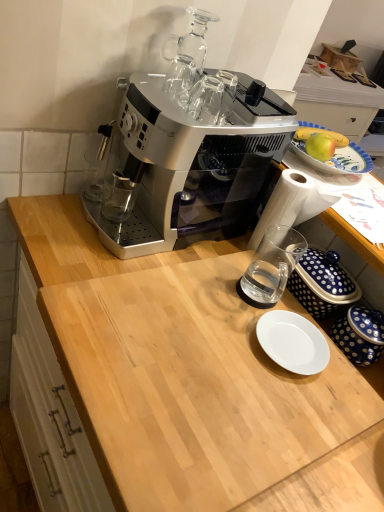
Question: In terms of width, does white glossy plate at center look wider or thinner when compared to clear glass cup at center?

Choices:
 (A) thin
 (B) wide

Answer: (B)

Question: From the image's perspective, is white glossy plate at center located above or below clear glass cup at center?

Choices:
 (A) above
 (B) below

Answer: (B)

Question: Which object is positioned closest to the transparent glass cups at upper center?

Choices:
 (A) satin silver coffee maker at upper center
 (B) blue dotted ceramic jar at lower right
 (C) clear glass cup at center
 (D) green matte apple at upper right
 (E) light wood cutting board at center

Answer: (A)

Question: Which is farther from the light wood cutting board at center?

Choices:
 (A) clear glass cup at center
 (B) green matte apple at upper right
 (C) white glossy plate at center
 (D) transparent glass cups at upper center
 (E) satin silver coffee maker at upper center

Answer: (B)